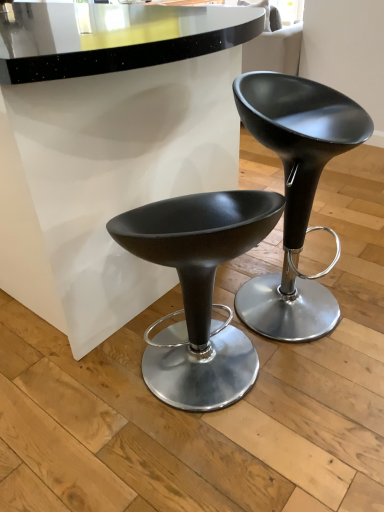
Question: Is matte black stool at center, the 2th stool when ordered from right to left, in front of or behind matte black stool at center, which is the 1th stool in right-to-left order, in the image?

Choices:
 (A) front
 (B) behind

Answer: (A)

Question: From the image's perspective, relative to matte black stool at center, which is the 1th stool in right-to-left order, is matte black stool at center, the 2th stool when ordered from right to left, above or below?

Choices:
 (A) above
 (B) below

Answer: (B)

Question: Considering the positions of matte black stool at center, the 2th stool when ordered from right to left, and matte black stool at center, which is the 1th stool in right-to-left order, in the image, is matte black stool at center, the 2th stool when ordered from right to left, taller or shorter than matte black stool at center, which is the 1th stool in right-to-left order,?

Choices:
 (A) short
 (B) tall

Answer: (A)

Question: In the image, is matte black stool at center, which is the 1th stool in right-to-left order, positioned in front of or behind matte black stool at center, the 2th stool when ordered from right to left?

Choices:
 (A) front
 (B) behind

Answer: (B)

Question: In the image, is matte black stool at center, which is the 1th stool in right-to-left order, on the left side or the right side of matte black stool at center, the first stool when ordered from left to right?

Choices:
 (A) right
 (B) left

Answer: (A)

Question: In terms of size, does matte black stool at center, positioned as the 2th stool in left-to-right order, appear bigger or smaller than matte black stool at center, the first stool when ordered from left to right?

Choices:
 (A) small
 (B) big

Answer: (B)

Question: From the image's perspective, is matte black stool at center, which is the 1th stool in right-to-left order, located above or below matte black stool at center, the first stool when ordered from left to right?

Choices:
 (A) below
 (B) above

Answer: (B)